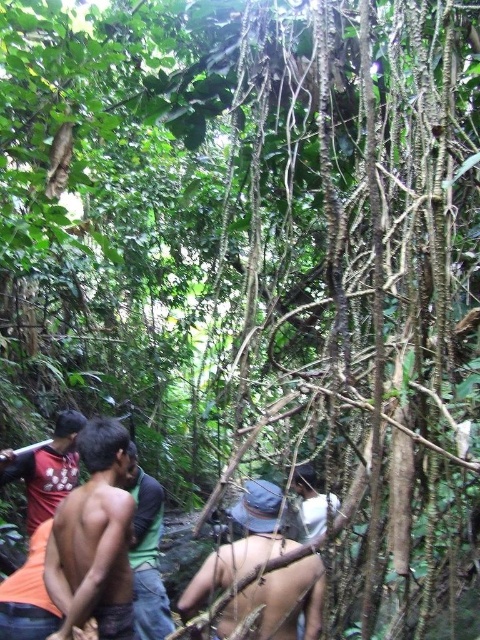
You are part of the jungle trekking group and need to locate your friend wearing the green shirt at center. From your position at the back of the group, which direction should you look relative to the white matte shirt at center to find them?

The green shirt at center is to the left of the white matte shirt at center, so you should look to the left side of the white matte shirt at center to locate your friend.

You are part of the jungle trekking group and need to locate the green shirt at center. Based on the coordinates provided, where should you look relative to your current position?

The green shirt at center is located at point 0.864 on the horizontal axis and 0.306 on the vertical axis, so you should look towards the upper right direction from your current position.

You are part of the jungle trekking group and want to take a photo of the blue fabric hat at center and the green shirt at center. Which object should you focus on first to ensure both are in focus?

You should focus on the blue fabric hat at center first because it is closer to the viewer than the green shirt at center. By focusing on the closer object, the background object will still be in focus due to the depth of field.